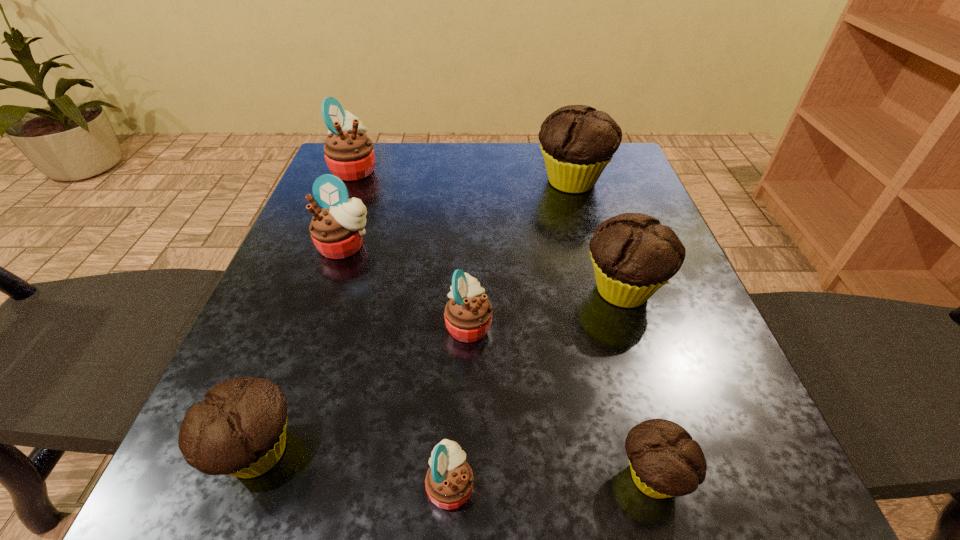
The image size is (960, 540). Identify the location of vacant space at the far edge of the desktop. 497,181.

The height and width of the screenshot is (540, 960). I want to click on vacant space at the near edge, so click(512, 454).

Where is `vacant area at the left edge of the desktop`? vacant area at the left edge of the desktop is located at coordinates (363, 274).

Where is `vacant area at the right edge of the desktop`? This screenshot has width=960, height=540. vacant area at the right edge of the desktop is located at coordinates (681, 408).

Identify the location of vacant area at the near right corner of the desktop. The height and width of the screenshot is (540, 960). (678, 513).

At what (x,y) coordinates should I click in order to perform the action: click on vacant area between the third farthest pink muffin and the smallest pink muffin. Please return your answer as a coordinate pair (x, y). The width and height of the screenshot is (960, 540). Looking at the image, I should click on (460, 405).

Locate an element on the screen. The image size is (960, 540). empty space between the third smallest chocolate muffin and the second farthest pink muffin is located at coordinates (485, 268).

Where is `empty space between the third biggest pink muffin and the third smallest chocolate muffin`? The height and width of the screenshot is (540, 960). empty space between the third biggest pink muffin and the third smallest chocolate muffin is located at coordinates (546, 307).

What are the coordinates of `unoccupied area between the smallest chocolate muffin and the second nearest pink muffin` in the screenshot? It's located at (561, 401).

Locate an element on the screen. This screenshot has height=540, width=960. blank region between the third nearest pink muffin and the third nearest chocolate muffin is located at coordinates (485, 268).